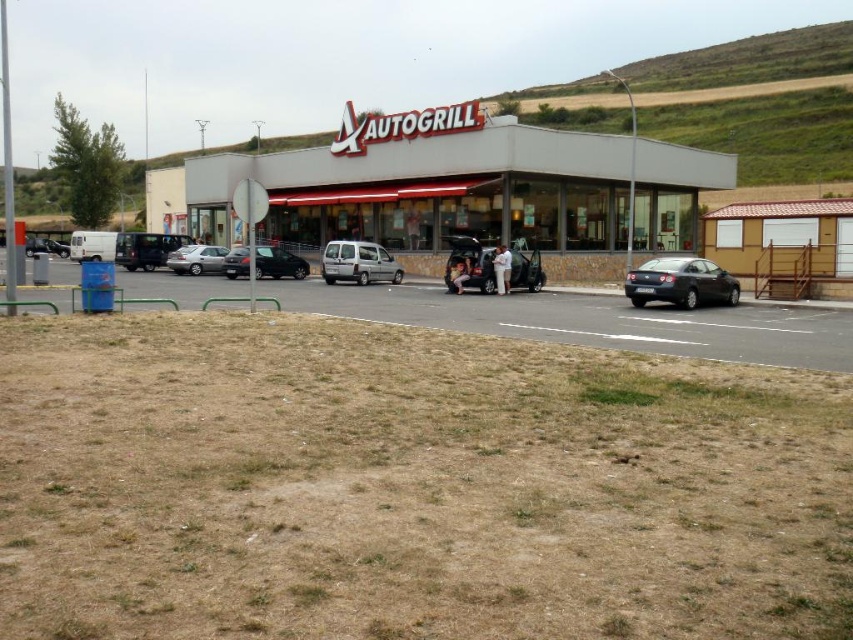
Question: Which of the following is the farthest from the observer?

Choices:
 (A) (126, 248)
 (B) (467, 262)
 (C) (241, 250)

Answer: (A)

Question: Is shiny black sedan at center-left behind satin silver sedan at center?

Choices:
 (A) no
 (B) yes

Answer: (A)

Question: Which point is farther to the camera?

Choices:
 (A) shiny black sedan at center-left
 (B) metallic silver car at center
 (C) white stone building at center
 (D) black car at center

Answer: (C)

Question: Is dark gray matte sedan at right above satin silver sedan at center?

Choices:
 (A) no
 (B) yes

Answer: (A)

Question: Estimate the real-world distances between objects in this image. Which object is closer to the white cotton shirt at center?

Choices:
 (A) metallic silver car at center
 (B) silver metallic van at center

Answer: (A)

Question: Is metallic silver van at left to the left of white fabric person at center from the viewer's perspective?

Choices:
 (A) no
 (B) yes

Answer: (B)